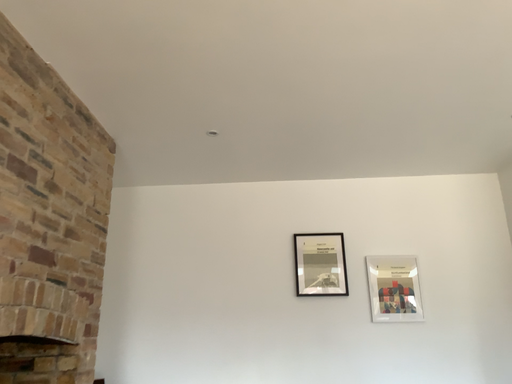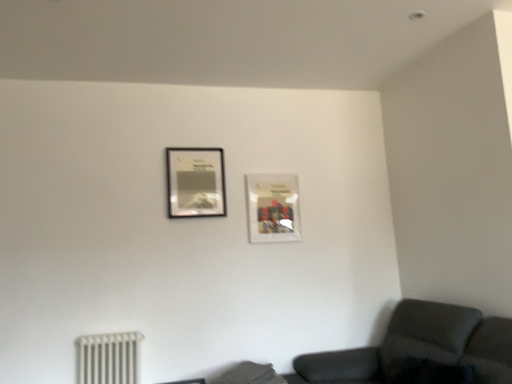
Question: How did the camera likely rotate when shooting the video?

Choices:
 (A) rotated left
 (B) rotated right

Answer: (B)